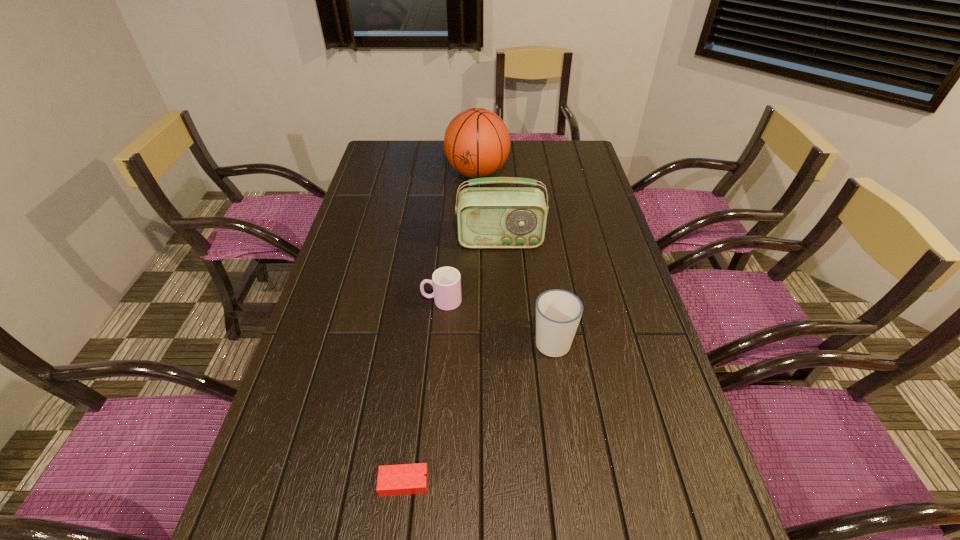
Image resolution: width=960 pixels, height=540 pixels. I want to click on vacant point that satisfies the following two spatial constraints: 1. on the back side of the shortest object; 2. on the right side of the basketball, so click(441, 174).

Locate an element on the screen. The height and width of the screenshot is (540, 960). free space that satisfies the following two spatial constraints: 1. on the back side of the basketball; 2. on the left side of the nearest object is located at coordinates (441, 174).

Identify the location of free space that satisfies the following two spatial constraints: 1. on the back side of the Lego; 2. with the handle on the side of the farther cup. (425, 301).